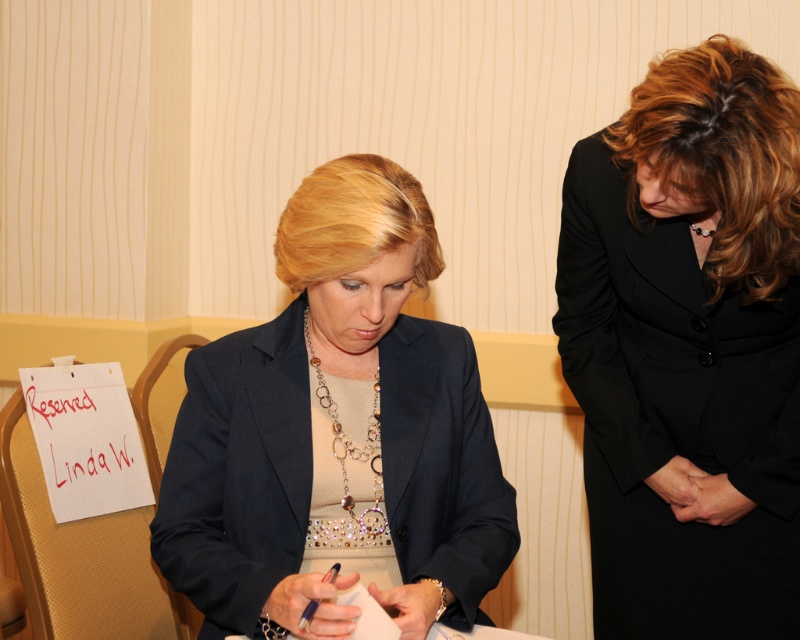
Consider the image. You are a photographer at a formal event and need to position a black wool coat at center for a photo shoot. According to the scene description, where should you place the coat in terms of coordinates?

The black wool coat at center should be placed at coordinates point (688, 348) as stated in the scene description.

You are a fashion designer observing two items in the scene. The black wool coat at center and the matte black blazer at center. Which one is taller?

The black wool coat at center is much taller as matte black blazer at center.